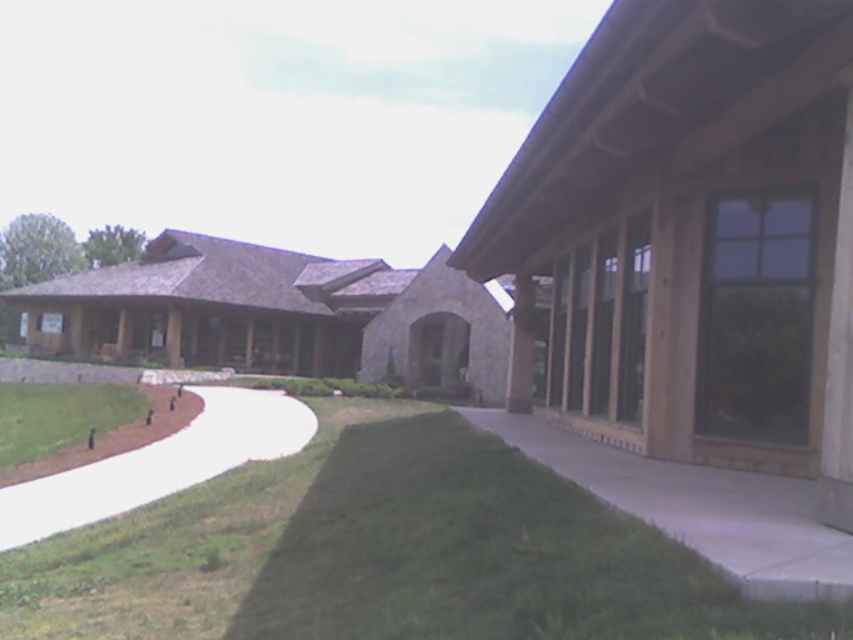
This screenshot has width=853, height=640. Identify the location of green grass at lower center. (384, 552).

Who is higher up, green grass at lower center or white concrete path at lower left?

green grass at lower center

Where is `green grass at lower center`? The width and height of the screenshot is (853, 640). green grass at lower center is located at coordinates (384, 552).

Image resolution: width=853 pixels, height=640 pixels. I want to click on green grass at lower center, so (384, 552).

Is white concrete path at lower left above green grass at lower left?

No.

Is white concrete path at lower left wider than green grass at lower left?

Incorrect, white concrete path at lower left's width does not surpass green grass at lower left's.

Measure the distance between white concrete path at lower left and camera.

8.05 meters

Find the location of `white concrete path at lower left`. white concrete path at lower left is located at coordinates (160, 464).

Is point (511, 420) farther from camera compared to point (16, 413)?

No, (511, 420) is closer to viewer.

Identify the location of concrete at center. The width and height of the screenshot is (853, 640). (699, 508).